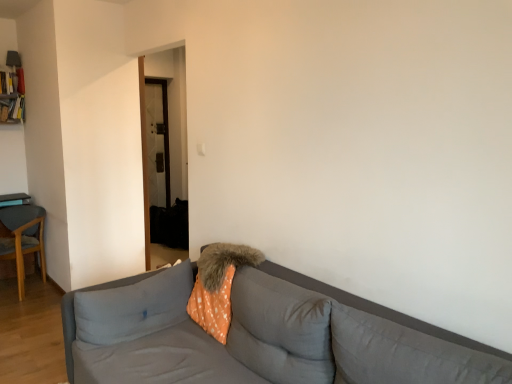
What do you see at coordinates (404, 354) in the screenshot? I see `gray fabric pillow at lower right, marked as the first pillow in a right-to-left arrangement` at bounding box center [404, 354].

This screenshot has height=384, width=512. Describe the element at coordinates (280, 329) in the screenshot. I see `orange polka dot pillow at center, which ranks as the 2th pillow in right-to-left order` at that location.

Find the location of a particular element. The image size is (512, 384). gray fabric couch at center is located at coordinates (253, 340).

Locate an element on the screen. gray fabric pillow at lower right, marked as the first pillow in a right-to-left arrangement is located at coordinates (404, 354).

Is orange polka dot pillow at center, the fourth pillow in the right-to-left sequence, turned away from wooden chair at left?

Absolutely, orange polka dot pillow at center, the fourth pillow in the right-to-left sequence, is directed away from wooden chair at left.

Is orange polka dot pillow at center, the first pillow when ordered from left to right, far from wooden chair at left?

orange polka dot pillow at center, the first pillow when ordered from left to right, is far away from wooden chair at left.

Which of these two, orange polka dot pillow at center, the fourth pillow in the right-to-left sequence, or wooden chair at left, is smaller?

With smaller size is orange polka dot pillow at center, the fourth pillow in the right-to-left sequence.

Visually, is orange polka dot pillow at center, the fourth pillow in the right-to-left sequence, positioned to the left or to the right of wooden chair at left?

orange polka dot pillow at center, the fourth pillow in the right-to-left sequence, is to the right of wooden chair at left.

From a real-world perspective, is gray fabric couch at center physically below wooden chair at left?

No, from a real-world perspective, gray fabric couch at center is not below wooden chair at left.

Measure the distance from gray fabric couch at center to wooden chair at left.

The distance of gray fabric couch at center from wooden chair at left is 7.69 feet.

Does gray fabric couch at center have a smaller size compared to wooden chair at left?

No.

Where is `studio couch on the left of gray fabric pillow at lower right, marked as the fourth pillow in a left-to-right arrangement`? Image resolution: width=512 pixels, height=384 pixels. studio couch on the left of gray fabric pillow at lower right, marked as the fourth pillow in a left-to-right arrangement is located at coordinates [253, 340].

Who is bigger, gray fabric couch at center or gray fabric pillow at lower right, marked as the first pillow in a right-to-left arrangement?

gray fabric couch at center.

Is gray fabric couch at center looking in the opposite direction of gray fabric pillow at lower right, marked as the fourth pillow in a left-to-right arrangement?

Absolutely, gray fabric couch at center is directed away from gray fabric pillow at lower right, marked as the fourth pillow in a left-to-right arrangement.

In terms of width, does gray fabric couch at center look wider or thinner when compared to gray fabric pillow at lower right, marked as the first pillow in a right-to-left arrangement?

In the image, gray fabric couch at center appears to be wider than gray fabric pillow at lower right, marked as the first pillow in a right-to-left arrangement.

From a real-world perspective, is gray fabric pillow at lower right, marked as the fourth pillow in a left-to-right arrangement, beneath orange polka dot fabric at center?

Actually, gray fabric pillow at lower right, marked as the fourth pillow in a left-to-right arrangement, is physically above orange polka dot fabric at center in the real world.

Does gray fabric pillow at lower right, marked as the first pillow in a right-to-left arrangement, have a greater height compared to orange polka dot fabric at center?

In fact, gray fabric pillow at lower right, marked as the first pillow in a right-to-left arrangement, may be shorter than orange polka dot fabric at center.

Who is bigger, gray fabric pillow at lower right, marked as the first pillow in a right-to-left arrangement, or orange polka dot fabric at center?

orange polka dot fabric at center.

Does orange polka dot fabric at center contain fuzzy orange pillow at center, positioned as the second pillow in left-to-right order?

That's correct, fuzzy orange pillow at center, positioned as the second pillow in left-to-right order, is inside orange polka dot fabric at center.

Considering the relative sizes of orange polka dot fabric at center and fuzzy orange pillow at center, placed as the 3th pillow when sorted from right to left, in the image provided, is orange polka dot fabric at center thinner than fuzzy orange pillow at center, placed as the 3th pillow when sorted from right to left,?

Yes, orange polka dot fabric at center is thinner than fuzzy orange pillow at center, placed as the 3th pillow when sorted from right to left.

Could you tell me if orange polka dot fabric at center is facing fuzzy orange pillow at center, placed as the 3th pillow when sorted from right to left?

Yes, orange polka dot fabric at center is oriented towards fuzzy orange pillow at center, placed as the 3th pillow when sorted from right to left.

From a real-world perspective, which is physically below, gray fabric couch at center or orange polka dot pillow at center, which is the 3th pillow from left to right?

gray fabric couch at center is physically lower.

In terms of width, does gray fabric couch at center look wider or thinner when compared to orange polka dot pillow at center, which ranks as the 2th pillow in right-to-left order?

In the image, gray fabric couch at center appears to be wider than orange polka dot pillow at center, which ranks as the 2th pillow in right-to-left order.

Is gray fabric couch at center positioned far away from orange polka dot pillow at center, which is the 3th pillow from left to right?

No, gray fabric couch at center is in close proximity to orange polka dot pillow at center, which is the 3th pillow from left to right.

How different are the orientations of wooden chair at left and gray fabric pillow at lower right, marked as the first pillow in a right-to-left arrangement, in degrees?

The angle between the facing direction of wooden chair at left and the facing direction of gray fabric pillow at lower right, marked as the first pillow in a right-to-left arrangement, is 32.8 degrees.

Who is shorter, wooden chair at left or gray fabric pillow at lower right, marked as the fourth pillow in a left-to-right arrangement?

gray fabric pillow at lower right, marked as the fourth pillow in a left-to-right arrangement.

From the image's perspective, relative to gray fabric pillow at lower right, marked as the first pillow in a right-to-left arrangement, is wooden chair at left above or below?

From the image's perspective, wooden chair at left appears above gray fabric pillow at lower right, marked as the first pillow in a right-to-left arrangement.

In the image, there is a gray fabric pillow at lower right, marked as the fourth pillow in a left-to-right arrangement. Where is `chair below it (from a real-world perspective)`? The height and width of the screenshot is (384, 512). chair below it (from a real-world perspective) is located at coordinates (22, 238).

The width and height of the screenshot is (512, 384). Find the location of `chair that is behind the orange polka dot pillow at center, the first pillow when ordered from left to right`. chair that is behind the orange polka dot pillow at center, the first pillow when ordered from left to right is located at coordinates tap(22, 238).

Where is `chair above the gray fabric couch at center (from the image's perspective)`? chair above the gray fabric couch at center (from the image's perspective) is located at coordinates pos(22,238).

From the image, which object appears to be farther from wooden chair at left, orange polka dot fabric at center or fuzzy orange pillow at center, placed as the 3th pillow when sorted from right to left?

orange polka dot fabric at center is further to wooden chair at left.

Considering their positions, is gray fabric couch at center positioned further to wooden chair at left than orange polka dot fabric at center?

gray fabric couch at center.

Looking at the image, which one is located further to orange polka dot pillow at center, which ranks as the 2th pillow in right-to-left order, gray fabric pillow at lower right, marked as the first pillow in a right-to-left arrangement, or orange polka dot fabric at center?

The object further to orange polka dot pillow at center, which ranks as the 2th pillow in right-to-left order, is orange polka dot fabric at center.

Based on their spatial positions, is gray fabric couch at center or wooden chair at left closer to gray fabric pillow at lower right, marked as the first pillow in a right-to-left arrangement?

The object closer to gray fabric pillow at lower right, marked as the first pillow in a right-to-left arrangement, is gray fabric couch at center.

Which object lies nearer to the anchor point orange polka dot fabric at center, orange polka dot pillow at center, which ranks as the 2th pillow in right-to-left order, or orange polka dot pillow at center, the first pillow when ordered from left to right?

orange polka dot pillow at center, the first pillow when ordered from left to right.

Considering their positions, is orange polka dot pillow at center, which ranks as the 2th pillow in right-to-left order, positioned closer to gray fabric pillow at lower right, marked as the first pillow in a right-to-left arrangement, than wooden chair at left?

orange polka dot pillow at center, which ranks as the 2th pillow in right-to-left order.

Based on the photo, estimate the real-world distances between objects in this image. Which object is closer to gray fabric couch at center, wooden chair at left or orange polka dot pillow at center, which ranks as the 2th pillow in right-to-left order?

The object closer to gray fabric couch at center is orange polka dot pillow at center, which ranks as the 2th pillow in right-to-left order.

Which object lies nearer to the anchor point orange polka dot pillow at center, the first pillow when ordered from left to right, orange polka dot pillow at center, which is the 3th pillow from left to right, or wooden chair at left?

orange polka dot pillow at center, which is the 3th pillow from left to right, is closer to orange polka dot pillow at center, the first pillow when ordered from left to right.

Find the location of a particular element. This screenshot has width=512, height=384. throw pillow between gray fabric couch at center and wooden chair at left in the front-back direction is located at coordinates (218, 285).

Image resolution: width=512 pixels, height=384 pixels. Find the location of `throw pillow between gray fabric couch at center and fuzzy orange pillow at center, placed as the 3th pillow when sorted from right to left, from front to back`. throw pillow between gray fabric couch at center and fuzzy orange pillow at center, placed as the 3th pillow when sorted from right to left, from front to back is located at coordinates (218, 285).

Identify the location of throw pillow between wooden chair at left and fuzzy orange pillow at center, placed as the 3th pillow when sorted from right to left. Image resolution: width=512 pixels, height=384 pixels. (218, 285).

This screenshot has height=384, width=512. Find the location of `throw pillow between gray fabric pillow at lower right, marked as the fourth pillow in a left-to-right arrangement, and fuzzy orange pillow at center, positioned as the second pillow in left-to-right order, along the z-axis`. throw pillow between gray fabric pillow at lower right, marked as the fourth pillow in a left-to-right arrangement, and fuzzy orange pillow at center, positioned as the second pillow in left-to-right order, along the z-axis is located at coordinates (218, 285).